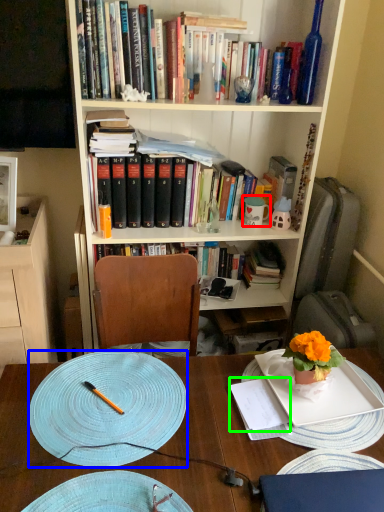
Question: Which object is the closest to the tableware (highlighted by a red box)? Choose among these: plate (highlighted by a blue box) or notebook (highlighted by a green box).

Choices:
 (A) plate
 (B) notebook

Answer: (B)